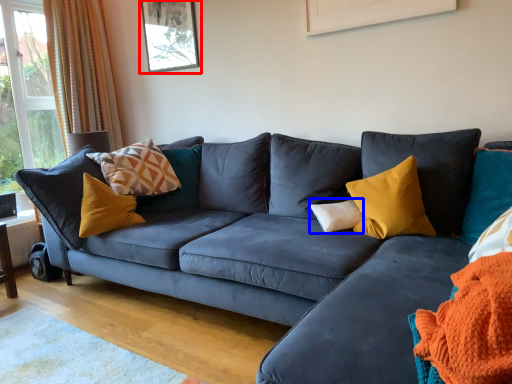
Question: Among these objects, which one is farthest to the camera, picture frame (highlighted by a red box) or pillow (highlighted by a blue box)?

Choices:
 (A) picture frame
 (B) pillow

Answer: (A)